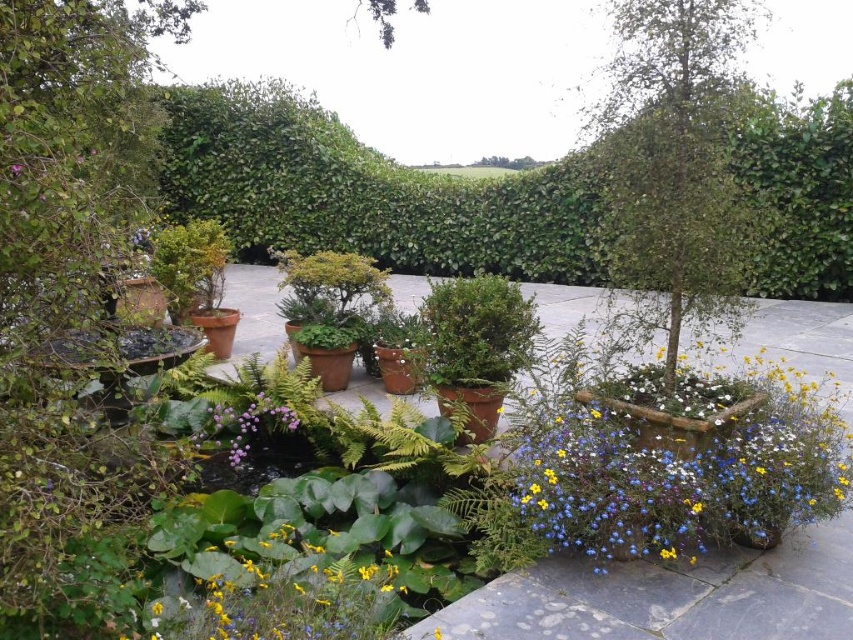
You are a gardener who needs to water the vibrant multicolored flowers at center right and the green leafy tree at center. Your watering can has a maximum reach of 24 inches. Can you water both plants without moving the watering can?

The distance between the vibrant multicolored flowers at center right and the green leafy tree at center is 24.59 inches, which is slightly more than the watering can reach of 24 inches. Therefore, you cannot water both plants without moving the watering can.

You are standing in the garden and want to locate the vibrant multicolored flowers at center right. According to the coordinates provided, where exactly are they positioned?

The vibrant multicolored flowers at center right are located at point (680,461).